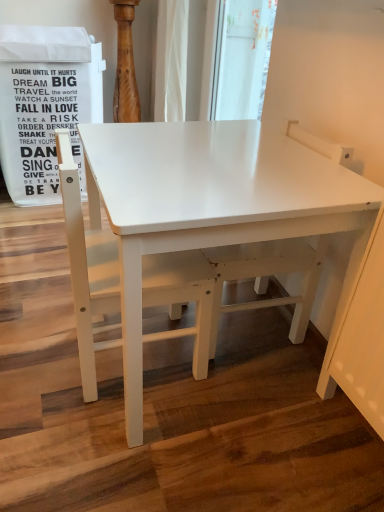
Question: From a real-world perspective, is white matte table at center on top of white matte swivel chair at center?

Choices:
 (A) yes
 (B) no

Answer: (B)

Question: Is white matte table at center at the right side of white matte swivel chair at center?

Choices:
 (A) no
 (B) yes

Answer: (A)

Question: Is white matte table at center far away from white matte swivel chair at center?

Choices:
 (A) no
 (B) yes

Answer: (A)

Question: From the image's perspective, is white matte table at center located above white matte swivel chair at center?

Choices:
 (A) yes
 (B) no

Answer: (B)

Question: From the image's perspective, does white matte table at center appear lower than white matte swivel chair at center?

Choices:
 (A) no
 (B) yes

Answer: (B)

Question: Is white matte swivel chair at center completely or partially inside white matte table at center?

Choices:
 (A) yes
 (B) no

Answer: (A)

Question: Does white matte chair at left have a greater width compared to white matte swivel chair at center?

Choices:
 (A) no
 (B) yes

Answer: (B)

Question: Would you consider white matte chair at left to be distant from white matte swivel chair at center?

Choices:
 (A) yes
 (B) no

Answer: (B)

Question: From a real-world perspective, is white matte chair at left beneath white matte swivel chair at center?

Choices:
 (A) yes
 (B) no

Answer: (B)

Question: From the image's perspective, would you say white matte chair at left is positioned over white matte swivel chair at center?

Choices:
 (A) no
 (B) yes

Answer: (A)

Question: Is white matte chair at left next to white matte swivel chair at center and touching it?

Choices:
 (A) no
 (B) yes

Answer: (A)

Question: Can you confirm if white matte chair at left is taller than white matte swivel chair at center?

Choices:
 (A) yes
 (B) no

Answer: (B)

Question: From the image's perspective, is white matte swivel chair at center under white matte chair at left?

Choices:
 (A) yes
 (B) no

Answer: (B)